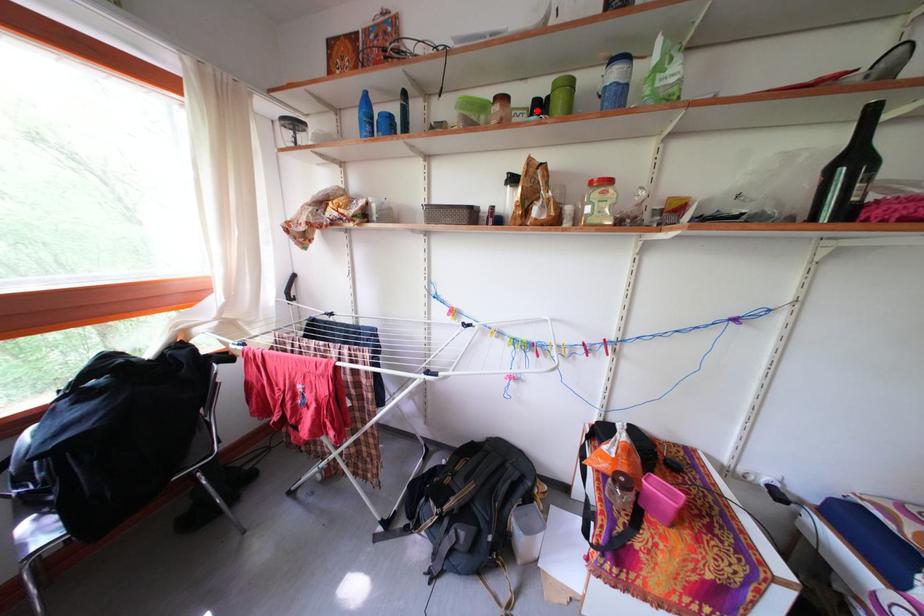
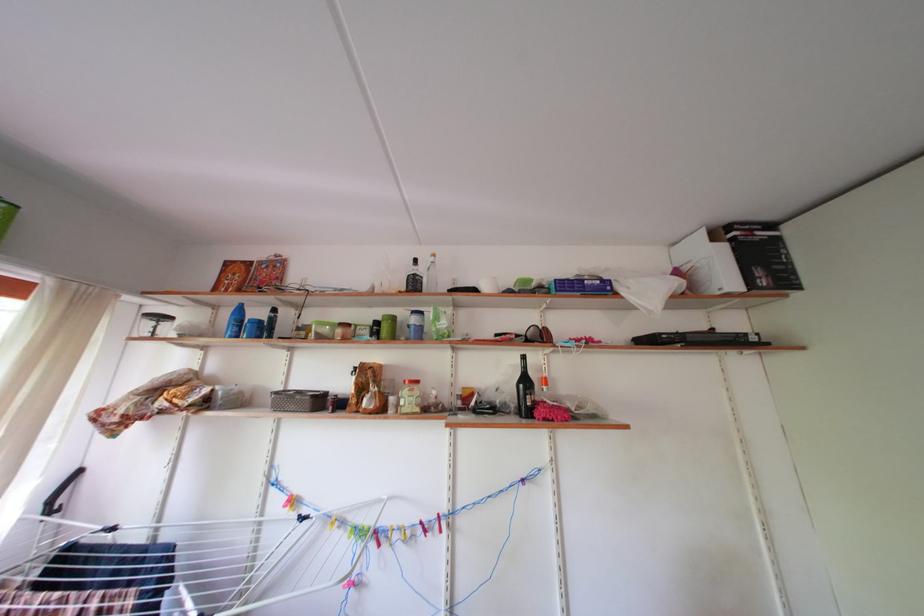
The point at the highlighted location is marked in the first image. Where is the corresponding point in the second image?

(380, 330)